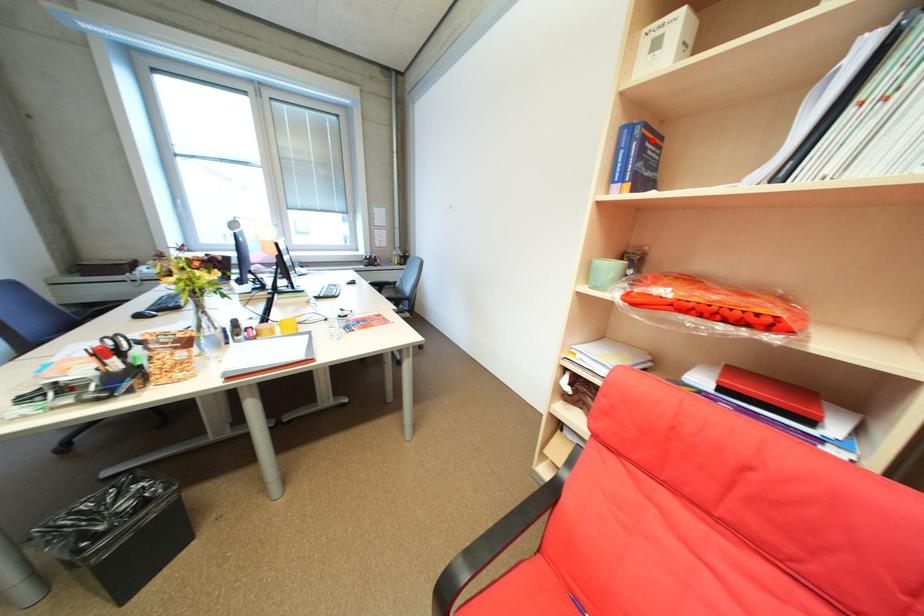
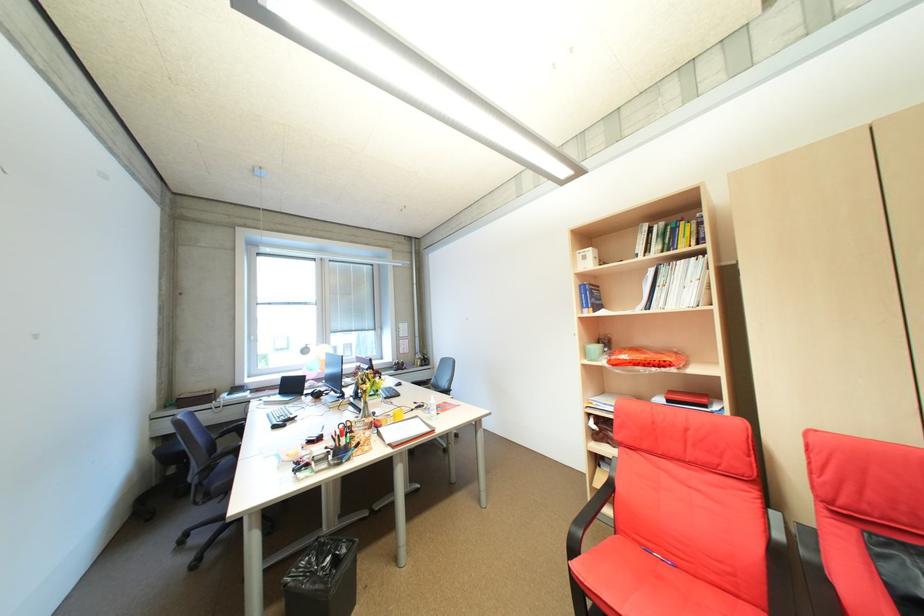
Question: I am providing you with two images of the same scene from different viewpoints. A red point is marked on the first image. Can you still see the location of the red point in image 2?

Choices:
 (A) Yes
 (B) No

Answer: (A)